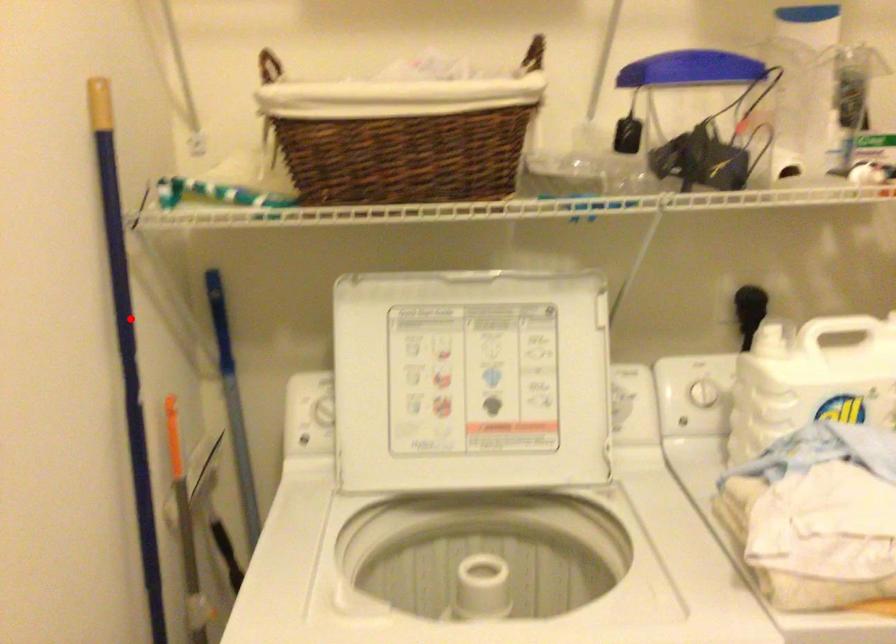
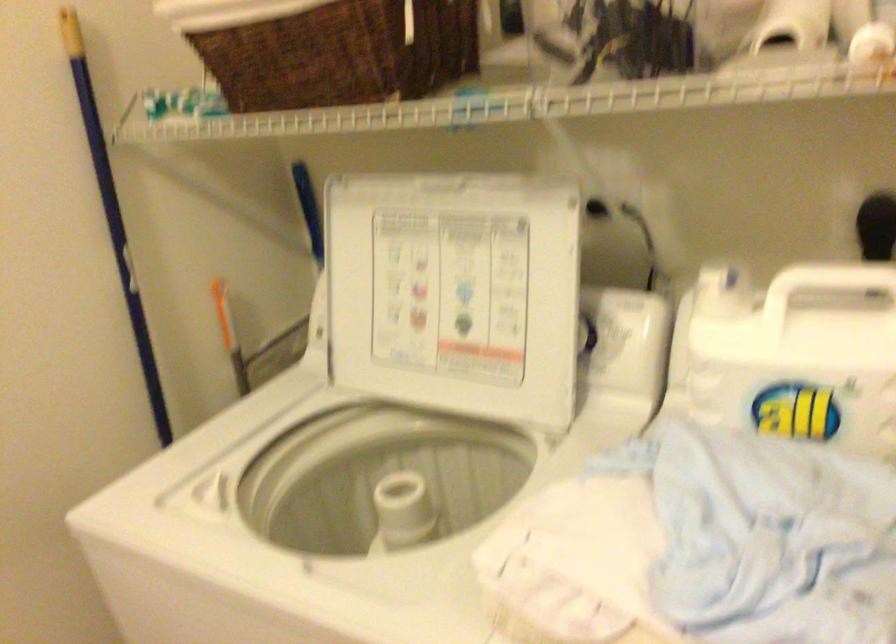
Question: I am providing you with two images of the same scene from different viewpoints. In image1, a red point is highlighted. Considering the same 3D point in image2, which of the following is correct?

Choices:
 (A) It is closer
 (B) It is farther

Answer: (B)